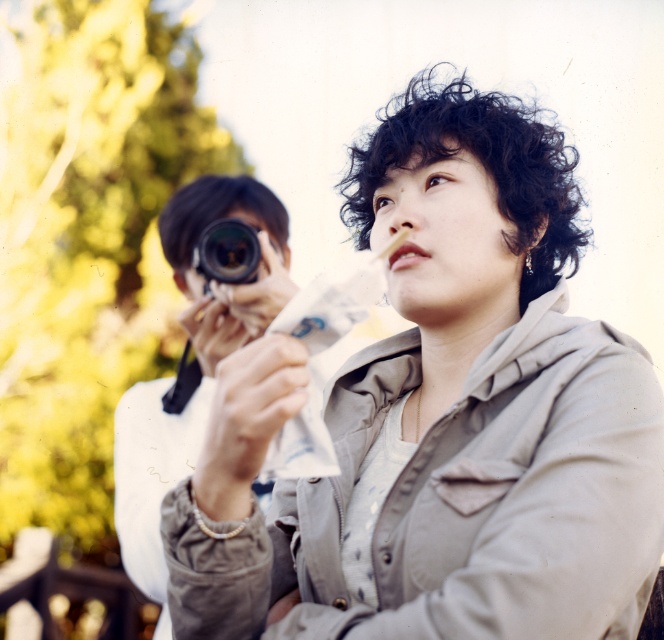
Question: Does matte beige jacket at center have a smaller size compared to matte white camera at center?

Choices:
 (A) no
 (B) yes

Answer: (A)

Question: Which of the following is the closest to the observer?

Choices:
 (A) (539, 257)
 (B) (238, 269)

Answer: (A)

Question: Observing the image, what is the correct spatial positioning of matte beige jacket at center in reference to black plastic camera at center?

Choices:
 (A) right
 (B) left

Answer: (A)

Question: Which of the following is the farthest from the observer?

Choices:
 (A) matte beige jacket at center
 (B) black plastic camera at center
 (C) matte white camera at center

Answer: (C)

Question: Which is farther from the black plastic camera at center?

Choices:
 (A) matte beige jacket at center
 (B) matte white camera at center

Answer: (A)

Question: Does matte beige jacket at center have a smaller size compared to black plastic camera at center?

Choices:
 (A) yes
 (B) no

Answer: (B)